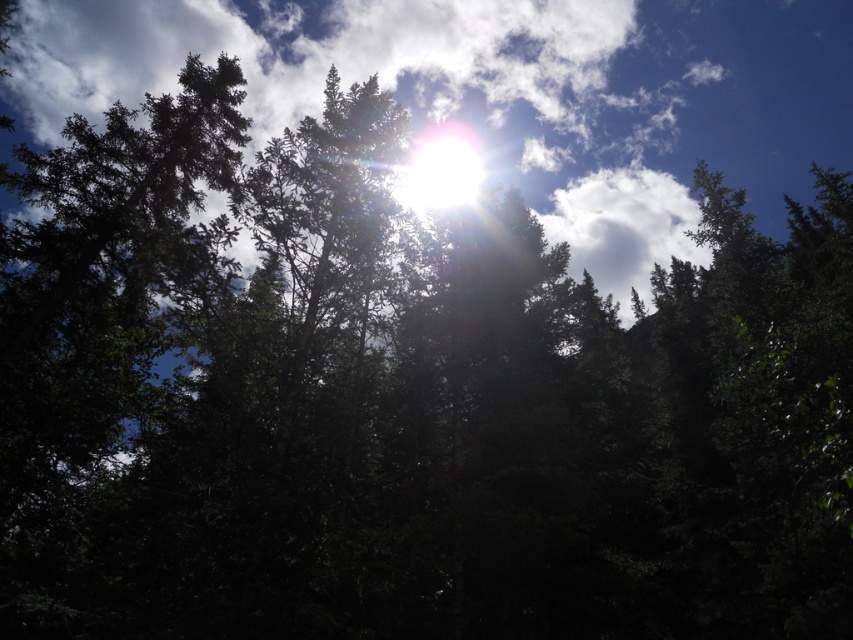
Where is `white fluffy cloud at upper center`? Image resolution: width=853 pixels, height=640 pixels. white fluffy cloud at upper center is located at coordinates (410, 93).

This screenshot has height=640, width=853. I want to click on white fluffy cloud at upper center, so click(410, 93).